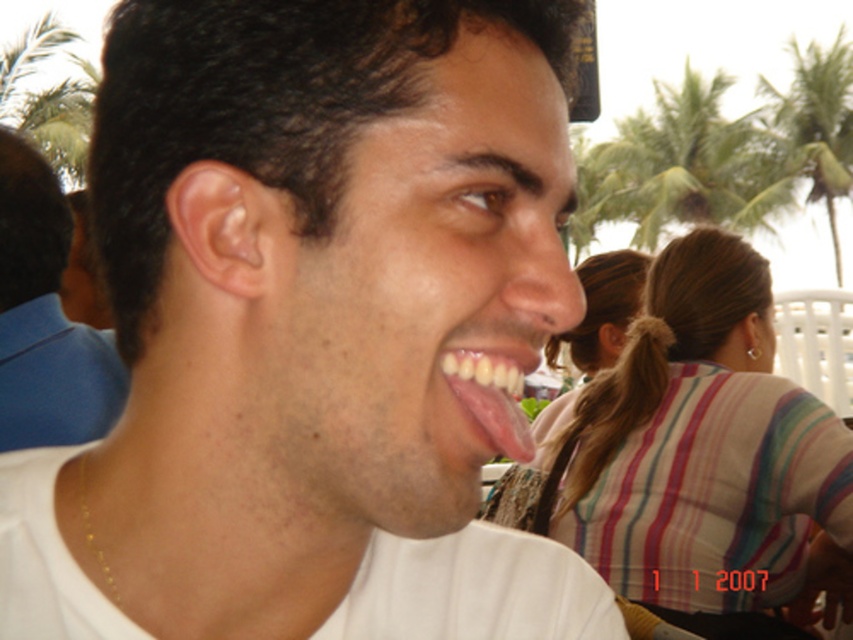
Describe the element at coordinates (45, 317) in the screenshot. I see `matte blue shirt at left` at that location.

Does point (51, 353) lie in front of point (682, 205)?

Yes, point (51, 353) is closer to viewer.

Where is `matte blue shirt at left`? The width and height of the screenshot is (853, 640). matte blue shirt at left is located at coordinates (45, 317).

Is green leafy palm tree at upper center shorter than green leafy palm tree at upper right?

Correct, green leafy palm tree at upper center is not as tall as green leafy palm tree at upper right.

Who is positioned more to the left, green leafy palm tree at upper center or green leafy palm tree at upper right?

From the viewer's perspective, green leafy palm tree at upper center appears more on the left side.

Is point (631, 200) positioned before point (837, 88)?

No.

This screenshot has height=640, width=853. I want to click on green leafy palm tree at upper center, so click(688, 164).

Is matte white face at center positioned in front of matte blue shirt at left?

Yes.

Is point (366, 461) positioned behind point (61, 312)?

No, it is in front of (61, 312).

Between point (543, 113) and point (22, 166), which one is positioned behind?

The point (22, 166) is behind.

The width and height of the screenshot is (853, 640). Find the location of `matte white face at center`. matte white face at center is located at coordinates (421, 300).